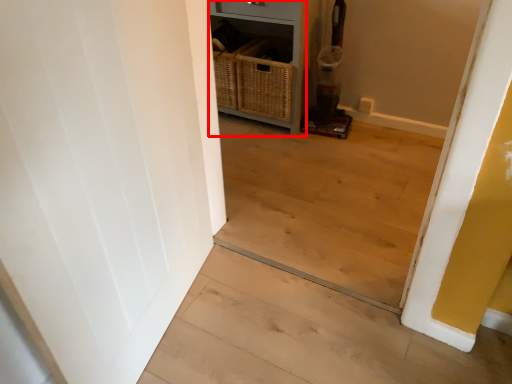
Question: From the image, what is the correct spatial relationship of dresser (annotated by the red box) in relation to stairwell?

Choices:
 (A) left
 (B) right

Answer: (A)